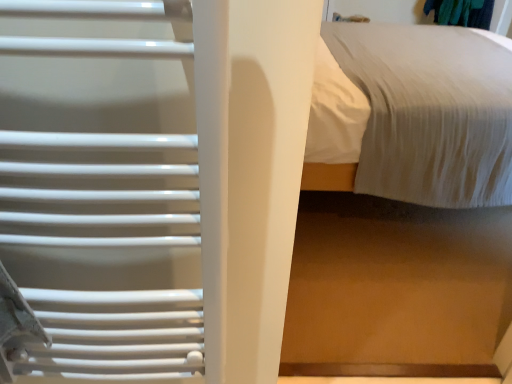
Question: In terms of width, does white textured bed at center, marked as the 1th bed in a front-to-back arrangement, look wider or thinner when compared to white textured bed at upper right, positioned as the first bed in back-to-front order?

Choices:
 (A) thin
 (B) wide

Answer: (A)

Question: Does point (446, 87) appear closer or farther from the camera than point (461, 51)?

Choices:
 (A) closer
 (B) farther

Answer: (A)

Question: Which is farther from the white textured bed at center, marked as the 1th bed in a front-to-back arrangement?

Choices:
 (A) white matte radiator at left
 (B) white textured bed at upper right, positioned as the first bed in back-to-front order

Answer: (A)

Question: Considering the real-world distances, which object is farthest from the white textured bed at upper right, which is the second bed in front-to-back order?

Choices:
 (A) white matte radiator at left
 (B) white textured bed at center, the 2th bed viewed from the back

Answer: (A)